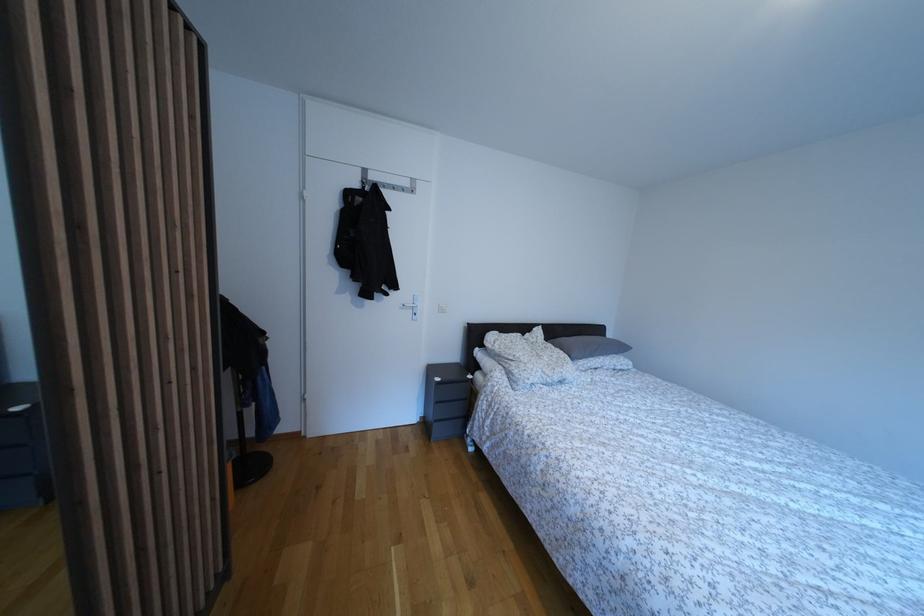
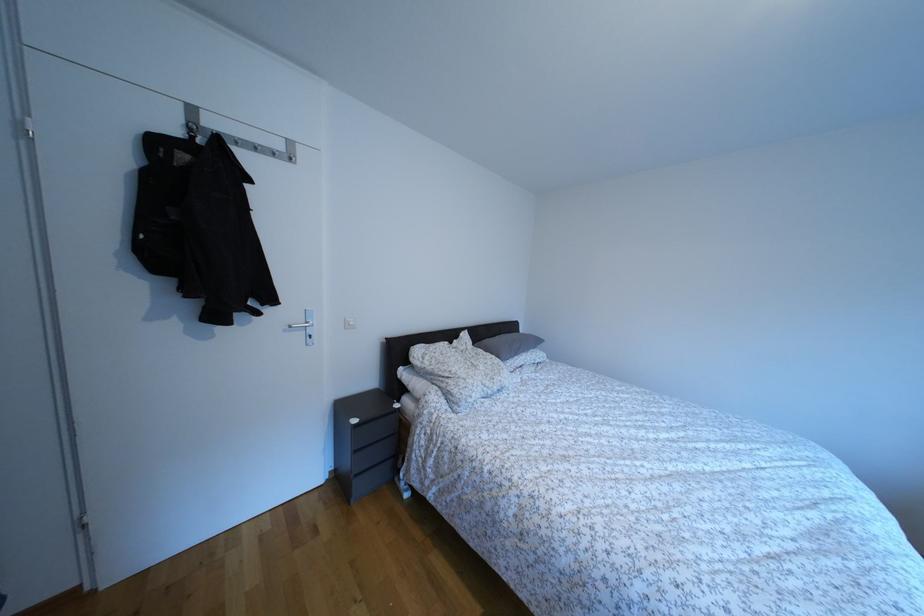
In the second image, find the point that corresponds to point 415,190 in the first image.

(286, 152)